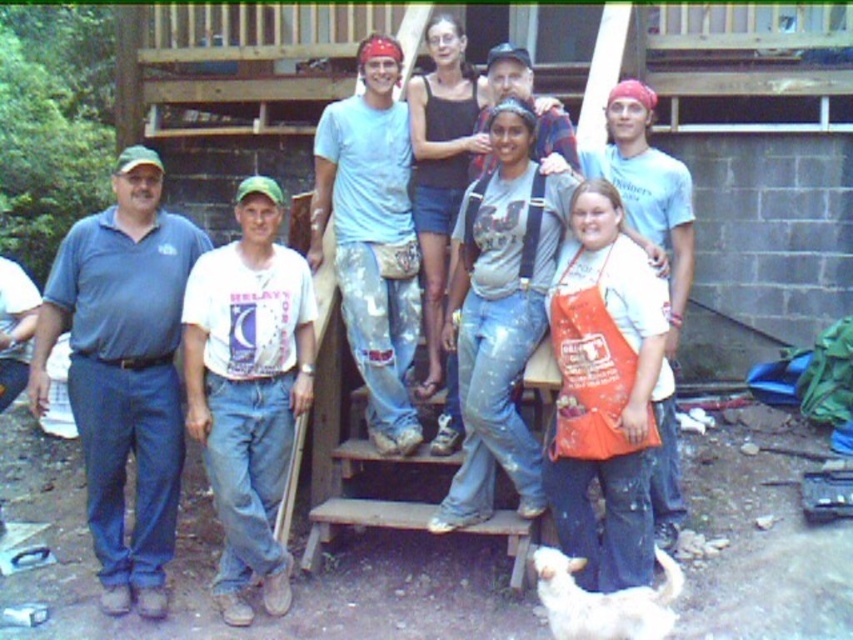
Does orange canvas apron at center have a lesser height compared to matte blue t-shirt at center?

Yes.

Who is shorter, orange canvas apron at center or matte blue t-shirt at center?

orange canvas apron at center

Locate an element on the screen. This screenshot has width=853, height=640. orange canvas apron at center is located at coordinates (605, 394).

Can you confirm if orange canvas apron at center is smaller than white cotton shirt at center?

Correct, orange canvas apron at center occupies less space than white cotton shirt at center.

Is point (561, 410) less distant than point (321, 202)?

That is True.

Locate an element on the screen. orange canvas apron at center is located at coordinates (605, 394).

Measure the distance between wooden at upper center and camera.

They are 24.60 feet apart.

This screenshot has height=640, width=853. I want to click on wooden at upper center, so [x=700, y=61].

The height and width of the screenshot is (640, 853). Identify the location of wooden at upper center. (700, 61).